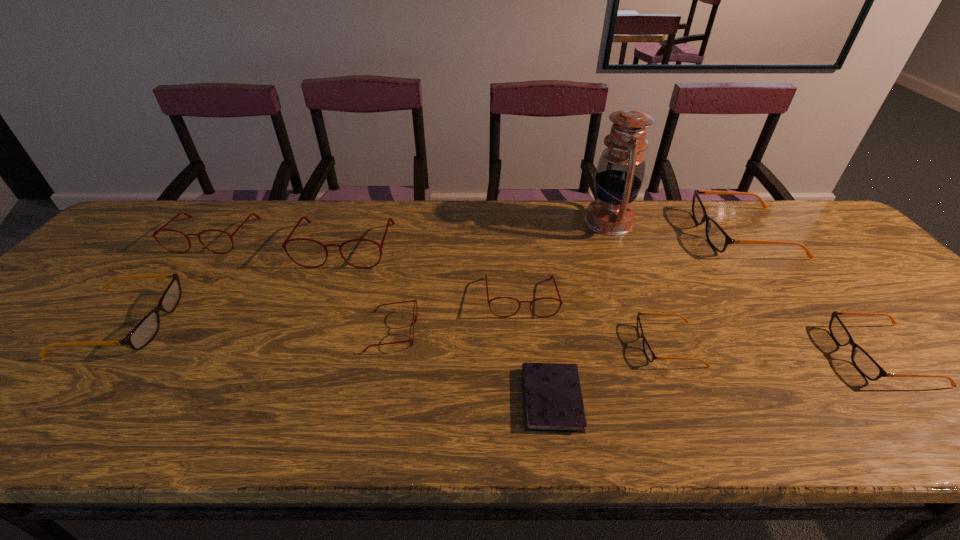
Find the location of a particular element. vacant space in between the shortest spectacles and the tallest spectacles is located at coordinates (507, 295).

At what (x,y) coordinates should I click in order to perform the action: click on free space between the third biggest red spectacles and the third biggest black spectacles. Please return your answer as a coordinate pair (x, y). Looking at the image, I should click on (702, 326).

You are a GUI agent. You are given a task and a screenshot of the screen. Output one action in this format:
    pyautogui.click(x=<x>, y=<y>)
    Task: Click on the vacant space that is in between the farthest black spectacles and the shortest object
    This screenshot has height=540, width=960.
    Given the screenshot: What is the action you would take?
    pyautogui.click(x=647, y=316)

At what (x,y) coordinates should I click in order to perform the action: click on free space between the oil lamp and the smallest red spectacles. Please return your answer as a coordinate pair (x, y). Looking at the image, I should click on (500, 276).

At what (x,y) coordinates should I click in order to perform the action: click on vacant space in between the rightmost red spectacles and the farthest black spectacles. Please return your answer as a coordinate pair (x, y). This screenshot has width=960, height=540. Looking at the image, I should click on (632, 265).

Find the location of `free space between the leftmost red spectacles and the shortest object`. free space between the leftmost red spectacles and the shortest object is located at coordinates (383, 317).

You are a GUI agent. You are given a task and a screenshot of the screen. Output one action in this format:
    pyautogui.click(x=<x>, y=<y>)
    Task: Click on the free point between the third smallest black spectacles and the third spectacles from right to left
    Image resolution: width=960 pixels, height=540 pixels.
    Given the screenshot: What is the action you would take?
    pyautogui.click(x=396, y=333)

Where is `blank region between the diary and the second smallest red spectacles`? The width and height of the screenshot is (960, 540). blank region between the diary and the second smallest red spectacles is located at coordinates (537, 348).

Where is `vacant space that is in between the second smallest black spectacles and the leftmost red spectacles`? vacant space that is in between the second smallest black spectacles and the leftmost red spectacles is located at coordinates (548, 295).

You are a GUI agent. You are given a task and a screenshot of the screen. Output one action in this format:
    pyautogui.click(x=<x>, y=<y>)
    Task: Click on the object that is the eighth nearest to the biggest red spectacles
    
    Given the screenshot: What is the action you would take?
    pyautogui.click(x=717, y=237)